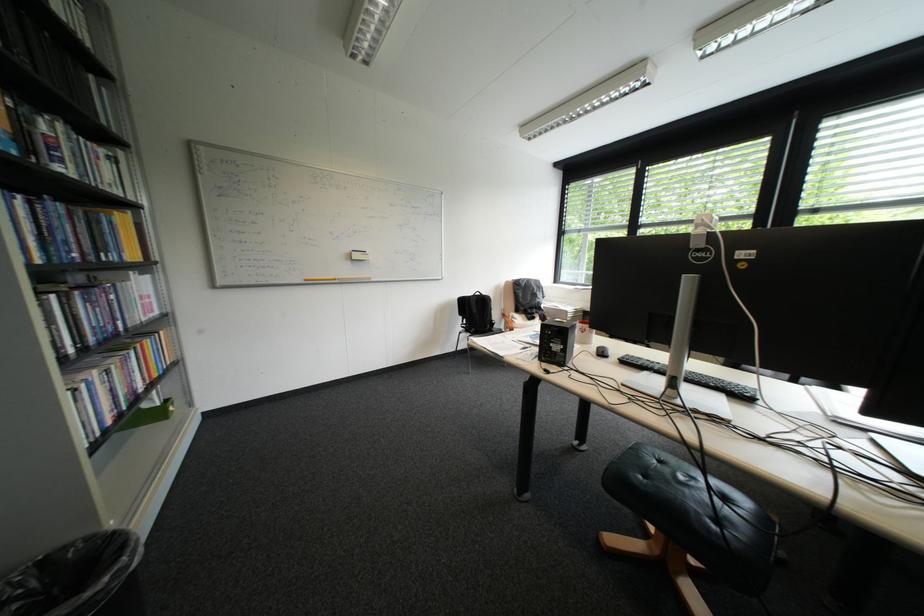
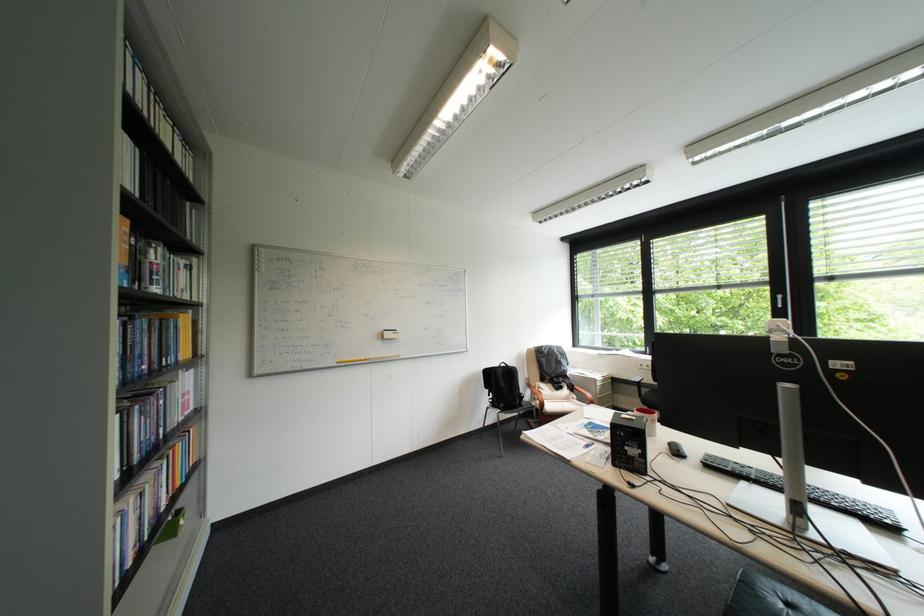
Locate, in the second image, the point that corresponds to (366,252) in the first image.

(397, 331)